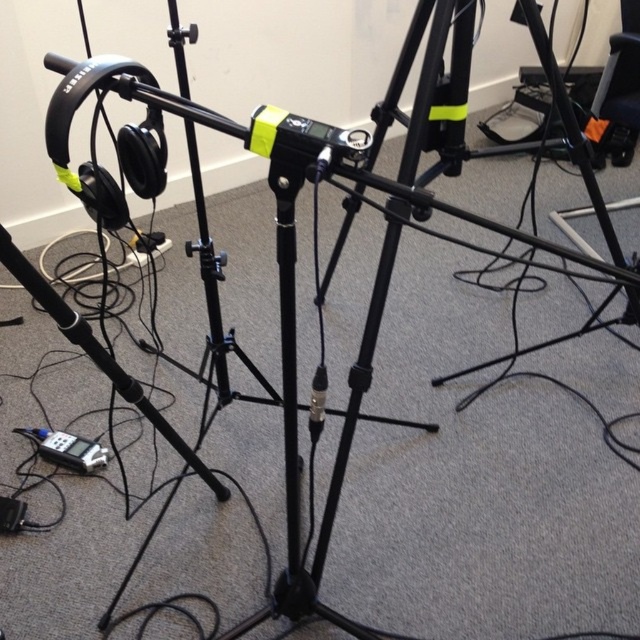
Can you confirm if black matte tripod at center is smaller than silver metallic digital device at lower left?

No.

Who is more forward, (x=419, y=106) or (x=44, y=452)?

Point (x=419, y=106) is in front.

Does point (552, 52) lie behind point (67, 435)?

Yes, it is behind point (67, 435).

At what (x,y) coordinates should I click in order to perform the action: click on black matte tripod at center. Please return your answer as a coordinate pair (x, y). This screenshot has height=640, width=640. Looking at the image, I should click on (445, 204).